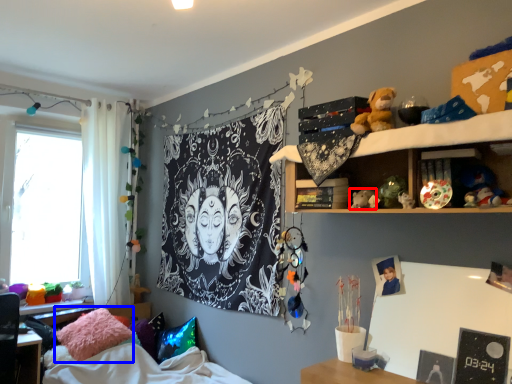
Question: Among these objects, which one is farthest to the camera, toy (highlighted by a red box) or pillow (highlighted by a blue box)?

Choices:
 (A) toy
 (B) pillow

Answer: (B)